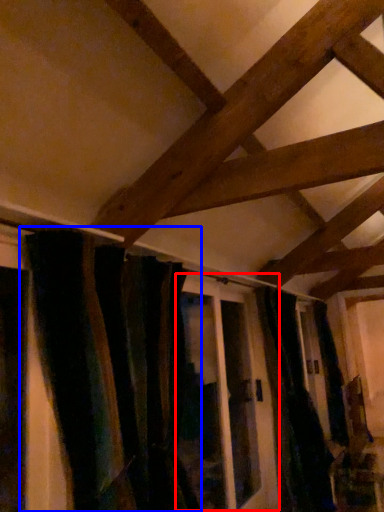
Question: Which object is further to the camera taking this photo, screen door (highlighted by a red box) or curtain (highlighted by a blue box)?

Choices:
 (A) screen door
 (B) curtain

Answer: (A)